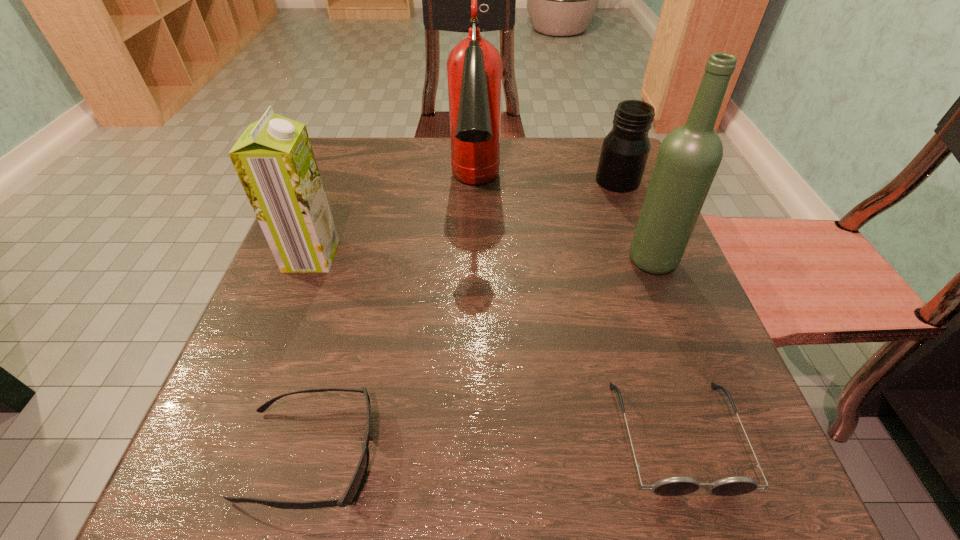
Find the location of a particular element. object located at the near right corner is located at coordinates [x=679, y=485].

Identify the location of vacant space at the far edge of the desktop. This screenshot has height=540, width=960. (560, 142).

The height and width of the screenshot is (540, 960). Find the location of `blank area at the near edge`. blank area at the near edge is located at coordinates (505, 494).

Where is `vacant space at the left edge of the desktop`? vacant space at the left edge of the desktop is located at coordinates (367, 234).

This screenshot has height=540, width=960. In the image, there is a desktop. What are the coordinates of `vacant space at the right edge` in the screenshot? It's located at coord(743,450).

In the image, there is a desktop. Where is `blank space at the far left corner`? Image resolution: width=960 pixels, height=540 pixels. blank space at the far left corner is located at coordinates (324, 178).

Where is `blank area at the far right corner`? blank area at the far right corner is located at coordinates (575, 159).

In the image, there is a desktop. Identify the location of vacant space at the near right corner. (684, 523).

Identify the location of free space between the right sunglasses and the jar. The height and width of the screenshot is (540, 960). (647, 308).

Locate an element on the screen. Image resolution: width=960 pixels, height=540 pixels. vacant space that's between the left sunglasses and the third object from left to right is located at coordinates (393, 323).